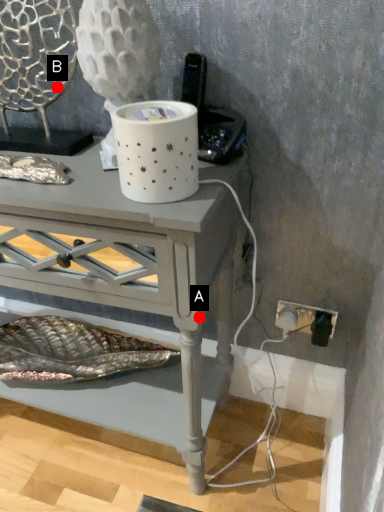
Question: Two points are circled on the image, labeled by A and B beside each circle. Which point is closer to the camera taking this photo?

Choices:
 (A) A is closer
 (B) B is closer

Answer: (A)